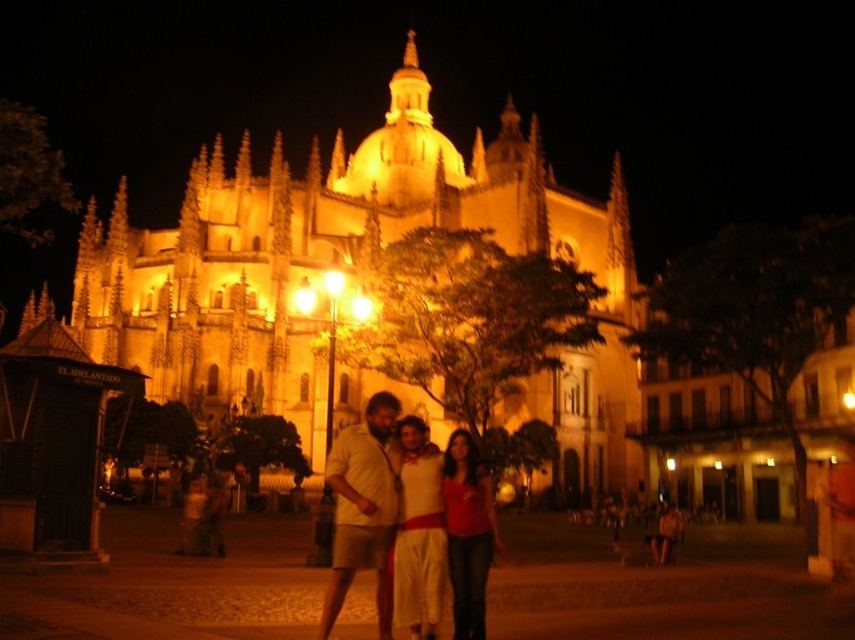
Question: Which object is farther from the camera taking this photo?

Choices:
 (A) beige cotton shirt at center
 (B) white cotton dress at center
 (C) matte red shirt at center

Answer: (C)

Question: Can you confirm if matte red shirt at center is bigger than matte beige shirt at center?

Choices:
 (A) yes
 (B) no

Answer: (B)

Question: Can you confirm if white cotton dress at center is wider than matte beige shirt at center?

Choices:
 (A) yes
 (B) no

Answer: (B)

Question: Does white cotton dress at center appear on the right side of matte red shirt at center?

Choices:
 (A) yes
 (B) no

Answer: (B)

Question: Among these objects, which one is farthest from the camera?

Choices:
 (A) matte red shirt at center
 (B) beige cotton shirt at center

Answer: (A)

Question: Which of the following is the closest to the observer?

Choices:
 (A) (444, 580)
 (B) (467, 625)

Answer: (B)